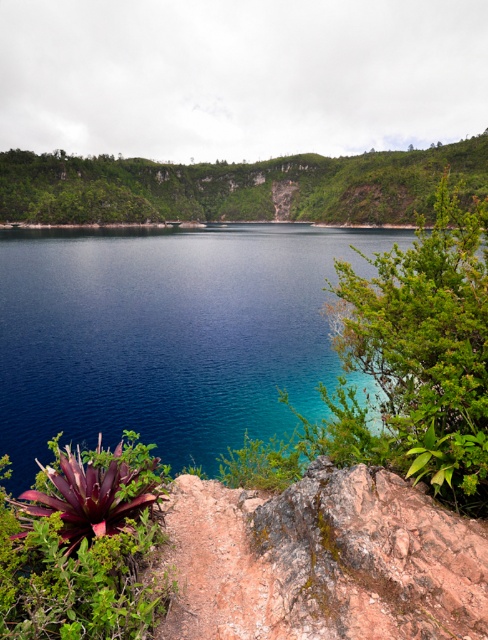
You are standing at the edge of the lake and see two points in the scene. The first point is at coordinates point [311,216] and the second point is at point [35,625]. Which point is closer to you?

Point [35,625] is closer to you because it is less further to the camera than point [311,216].

You are standing on the rocky outcrop and want to take a photo that includes both the blue water at center and the green leafy hillside at upper center. Which object should appear closer to the camera in your photo?

The blue water at center should appear closer to the camera in your photo because it is in front of the green leafy hillside at upper center.